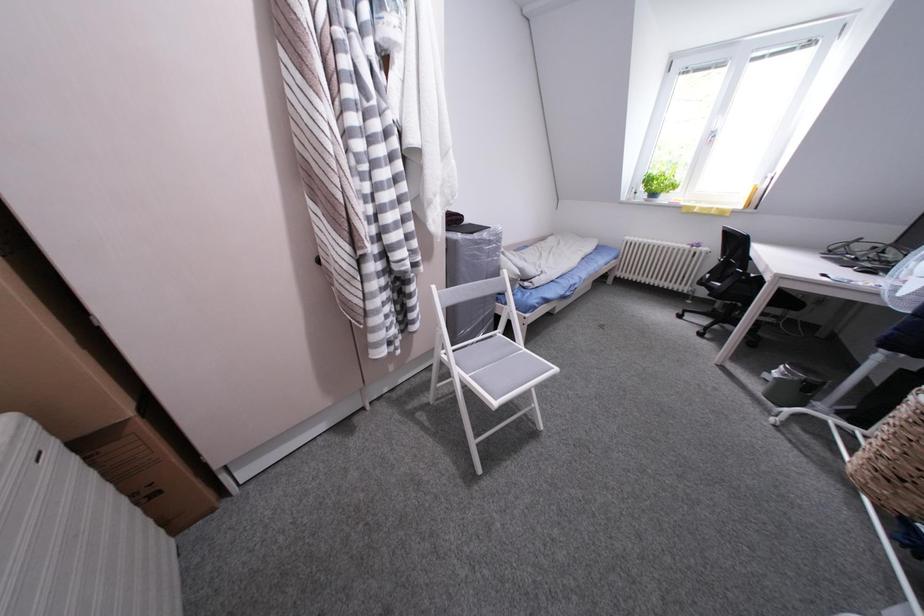
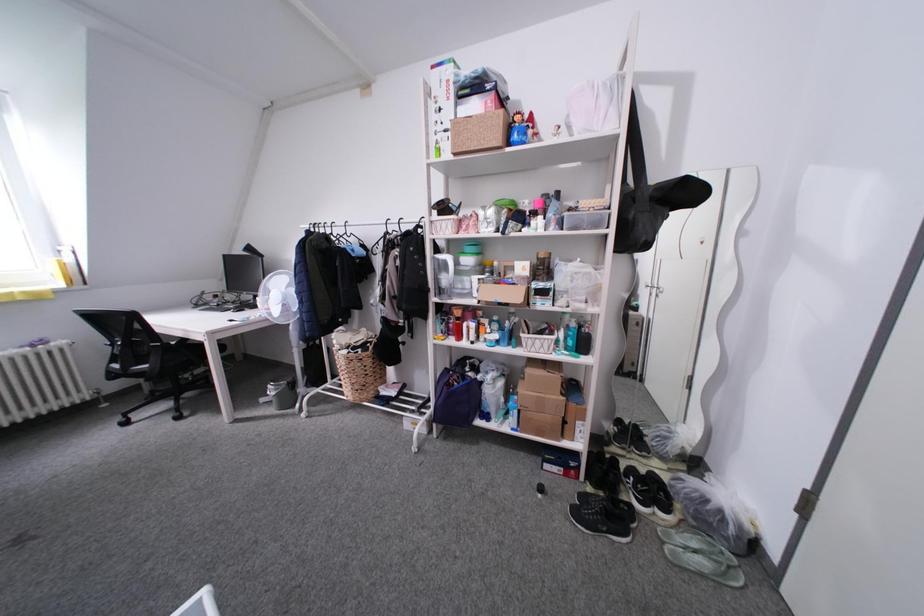
The images are taken continuously from a first-person perspective. In which direction is your viewpoint rotating?

The camera rotated toward right-down.